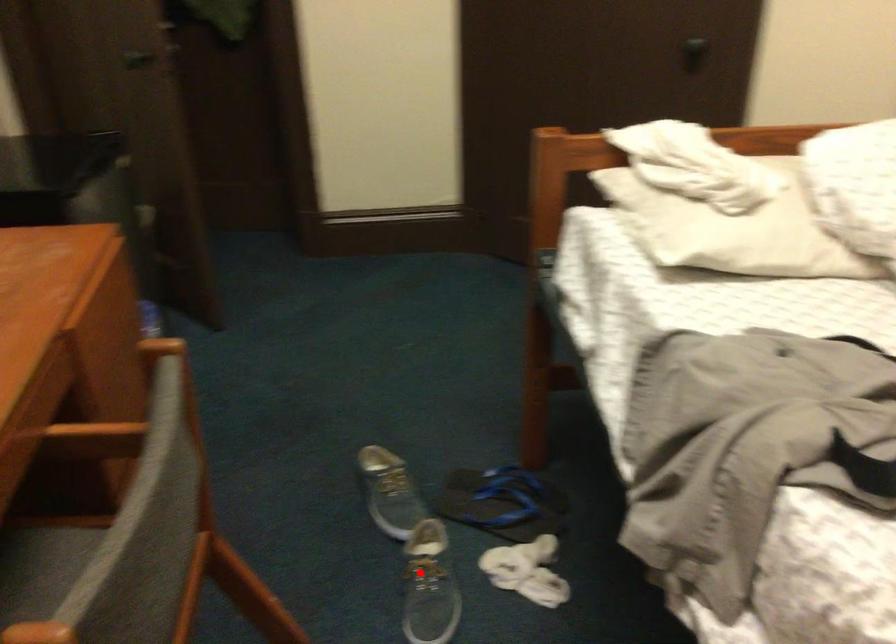
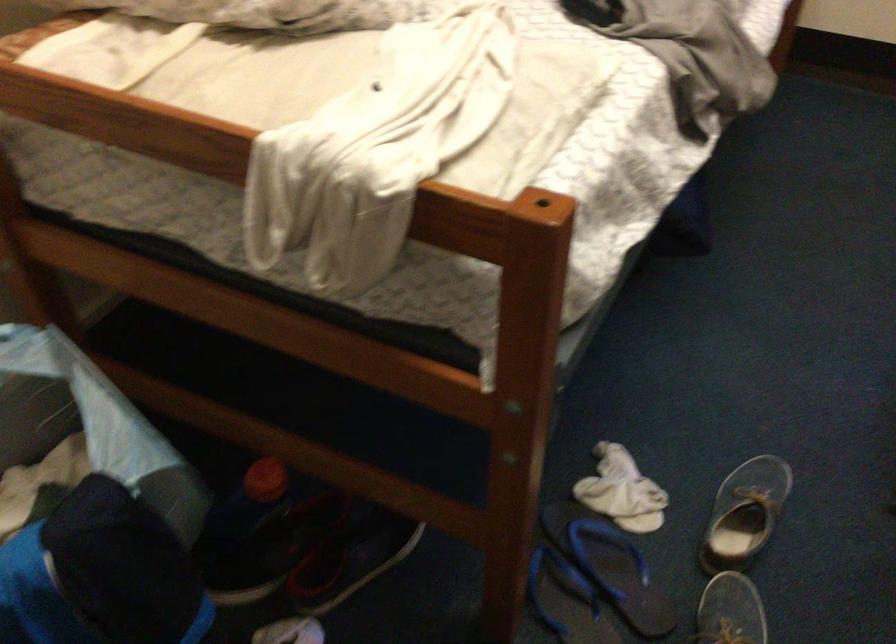
The point at the highlighted location is marked in the first image. Where is the corresponding point in the second image?

(745, 514)